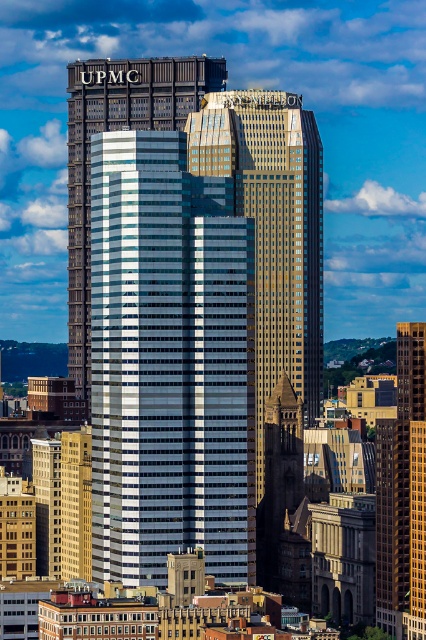
Is the position of white glass skyscraper at center less distant than that of gold glass skyscraper at center?

That is True.

Does white glass skyscraper at center lie behind gold glass skyscraper at center?

That is False.

Between point (71, 161) and point (420, 544), which one is positioned behind?

Point (420, 544)

Identify the location of white glass skyscraper at center. The width and height of the screenshot is (426, 640). (117, 129).

Measure the distance between metallic glass skyscraper at center and gold reflective glass skyscraper at center.

metallic glass skyscraper at center is 22.28 meters from gold reflective glass skyscraper at center.

Looking at this image, does metallic glass skyscraper at center lie behind gold reflective glass skyscraper at center?

No, it is in front of gold reflective glass skyscraper at center.

This screenshot has height=640, width=426. Identify the location of metallic glass skyscraper at center. (169, 362).

Locate an element on the screen. The image size is (426, 640). metallic glass skyscraper at center is located at coordinates (169, 362).

Does gold reflective glass skyscraper at center have a lesser height compared to gold glass skyscraper at center?

In fact, gold reflective glass skyscraper at center may be taller than gold glass skyscraper at center.

Does gold reflective glass skyscraper at center lie in front of gold glass skyscraper at center?

Yes, it is in front of gold glass skyscraper at center.

The width and height of the screenshot is (426, 640). Describe the element at coordinates (273, 228) in the screenshot. I see `gold reflective glass skyscraper at center` at that location.

I want to click on gold reflective glass skyscraper at center, so click(x=273, y=228).